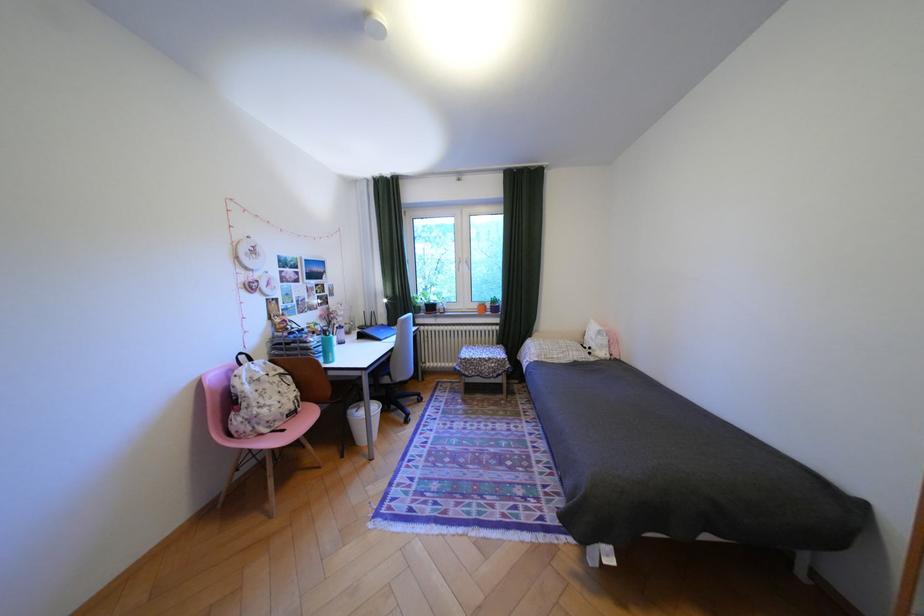
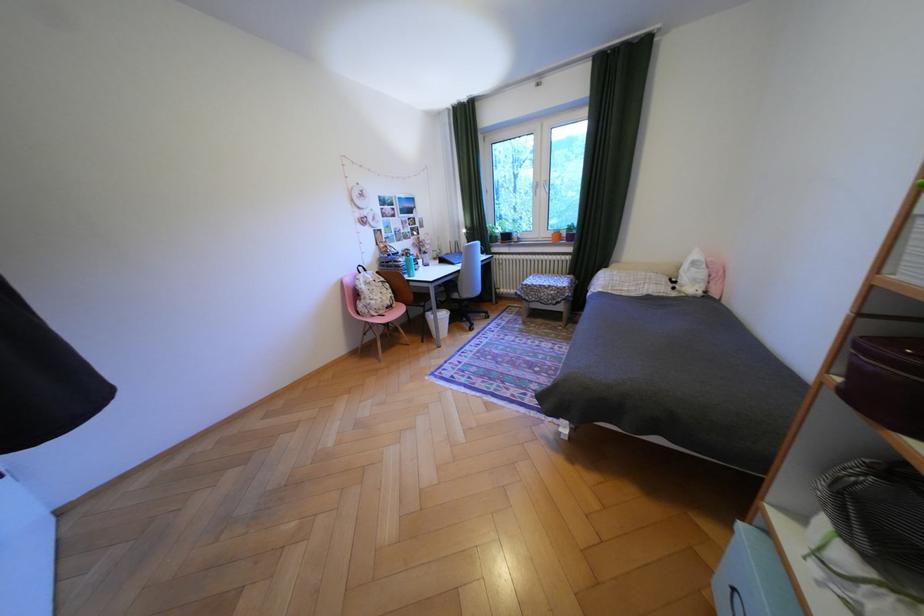
Where in the second image is the point corresponding to the point at 280,386 from the first image?

(386, 288)